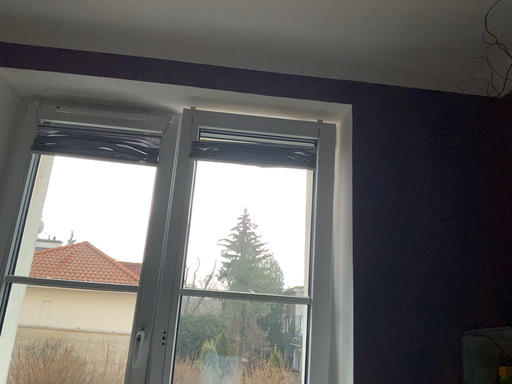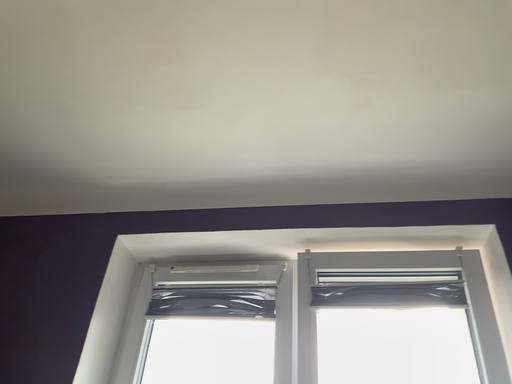
Question: How did the camera likely rotate when shooting the video?

Choices:
 (A) rotated left
 (B) rotated right

Answer: (A)